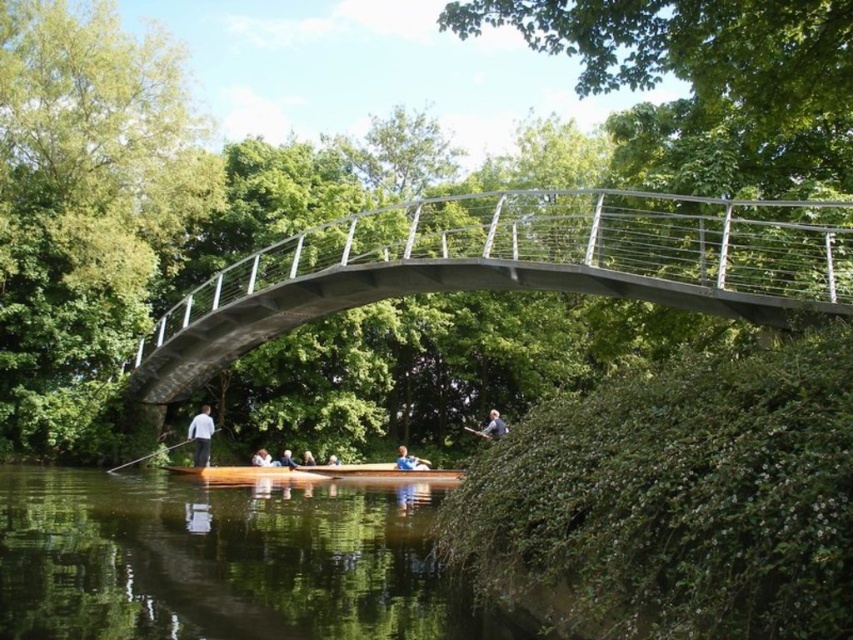
Question: Does metallic gray bridge at center have a lesser width compared to light brown wooden paddle at center?

Choices:
 (A) no
 (B) yes

Answer: (A)

Question: Which point appears closest to the camera in this image?

Choices:
 (A) (474, 429)
 (B) (193, 355)

Answer: (B)

Question: Is light brown wooden paddle at lower center wider than light brown wooden paddle at center?

Choices:
 (A) yes
 (B) no

Answer: (B)

Question: Does white matte shirt at lower left have a smaller size compared to blue fabric boat at center?

Choices:
 (A) no
 (B) yes

Answer: (A)

Question: Which object is closer to the camera taking this photo?

Choices:
 (A) blue fabric boat at center
 (B) wooden paddle at lower center
 (C) light gray fabric jacket at lower center

Answer: (C)

Question: Which of these objects is positioned farthest from the light gray fabric jacket at lower center?

Choices:
 (A) metallic gray bridge at center
 (B) brown wood river at lower center
 (C) wooden canoe at center
 (D) white matte shirt at lower left

Answer: (C)